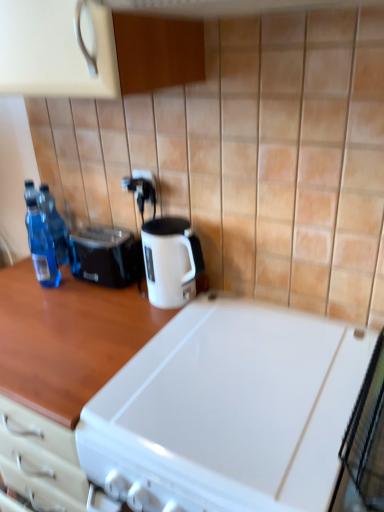
What are the coordinates of `vacant area that is in front of transparent plastic bottles at left, which is the first bottle from front to back` in the screenshot? It's located at (46, 305).